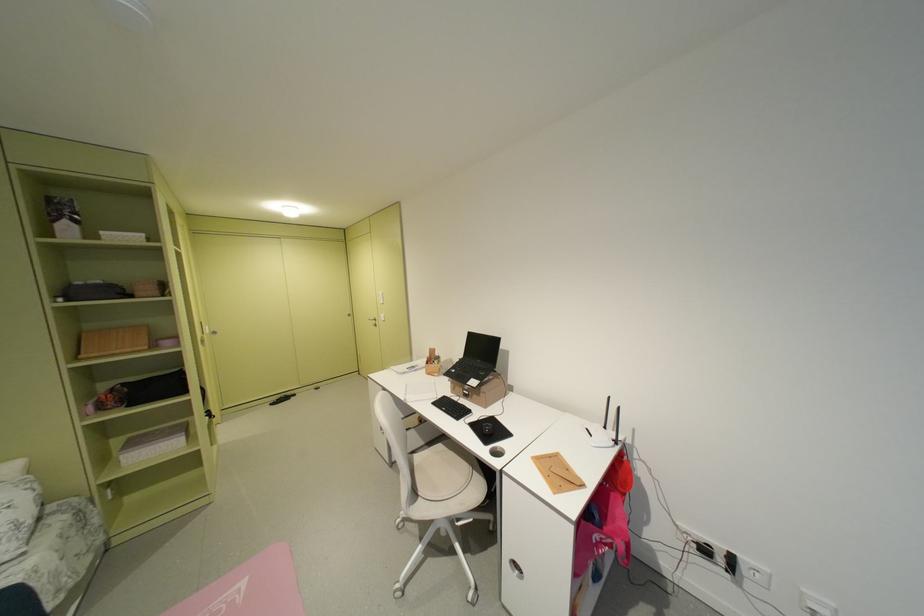
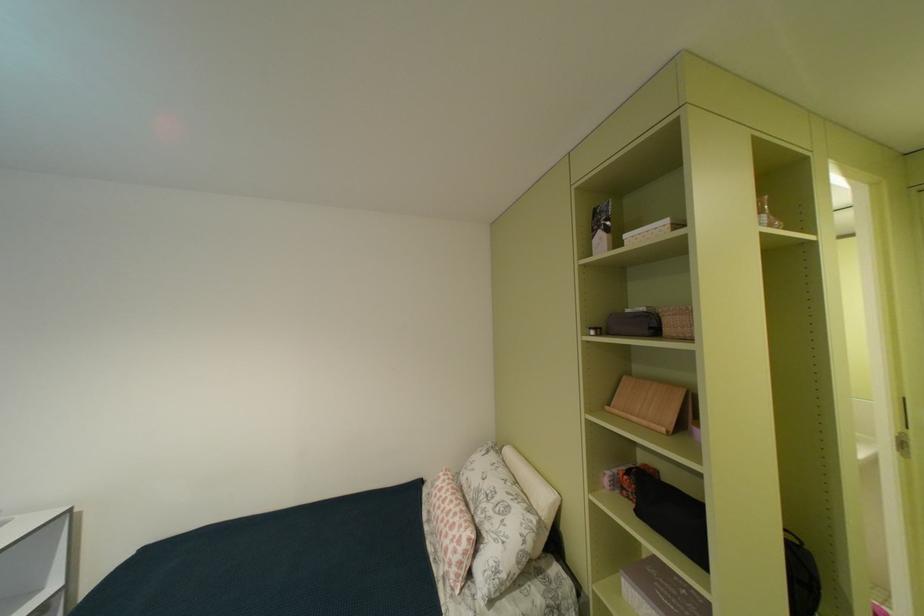
Find the pixel in the second image that matches the point at 152,236 in the first image.

(676, 223)